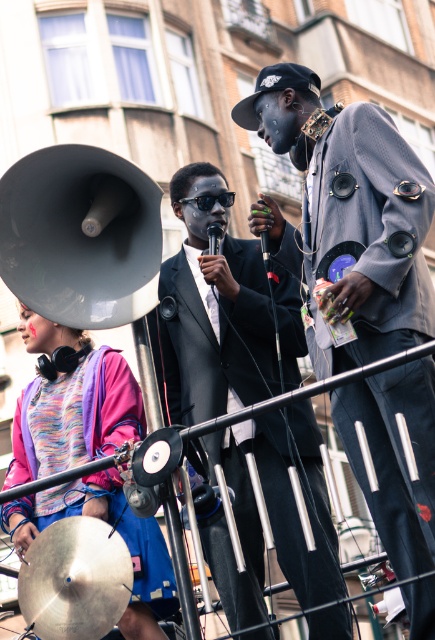
Question: Which of these objects is positioned closest to the multicolored fabric at lower left?

Choices:
 (A) matte gray jacket at center
 (B) shiny black suit at center
 (C) shiny silver cymbal at lower left

Answer: (B)

Question: Which point is farther from the camera taking this photo?

Choices:
 (A) coord(367,173)
 (B) coord(297,579)
 (C) coord(120,541)
 (D) coord(109,520)

Answer: (D)

Question: Does shiny black suit at center have a smaller size compared to multicolored fabric at lower left?

Choices:
 (A) no
 (B) yes

Answer: (A)

Question: Is multicolored fabric at lower left to the right of shiny silver cymbal at lower left from the viewer's perspective?

Choices:
 (A) yes
 (B) no

Answer: (B)

Question: Which point is farther from the camera taking this photo?

Choices:
 (A) (62, 600)
 (B) (347, 177)
 (C) (107, 484)
 (D) (216, 209)

Answer: (D)

Question: Is matte gray jacket at center smaller than shiny black suit at center?

Choices:
 (A) yes
 (B) no

Answer: (B)